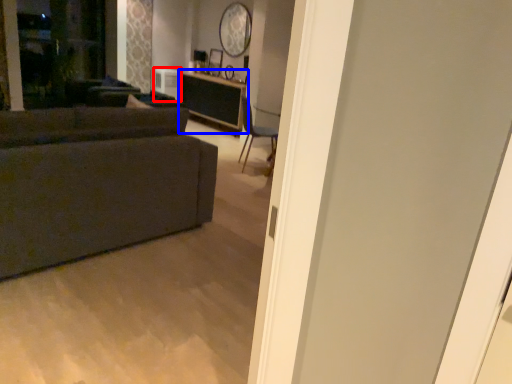
Question: Which point is further to the camera, appliance (highlighted by a red box) or table (highlighted by a blue box)?

Choices:
 (A) appliance
 (B) table

Answer: (A)